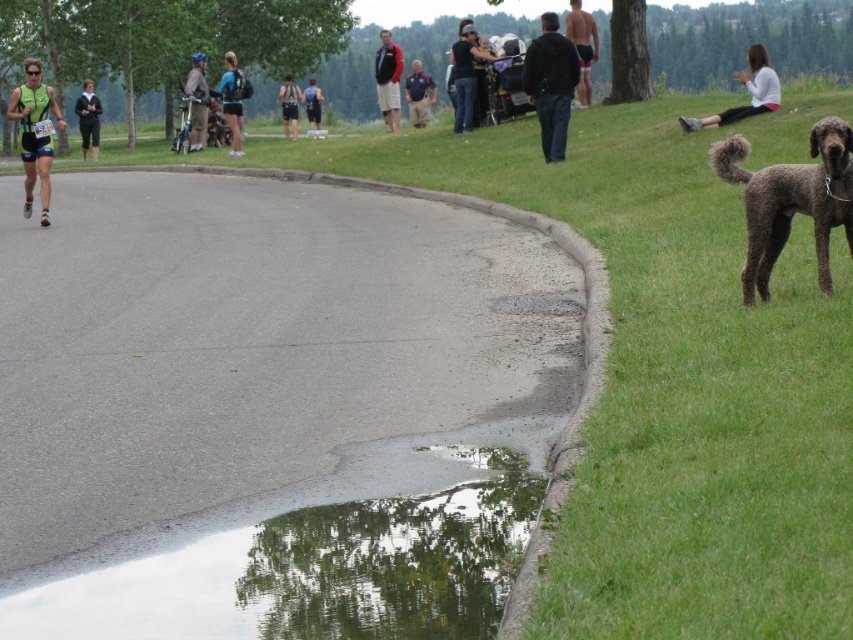
Consider the image. You are standing at the edge of the road and want to take a photo of both the dark brown curly fur at right and the red jacket at center. Which object should you focus on first to ensure both are in clear view?

You should focus on the dark brown curly fur at right first since it is closer to you than the red jacket at center, ensuring both are in focus when using a camera with a fixed focal plane.